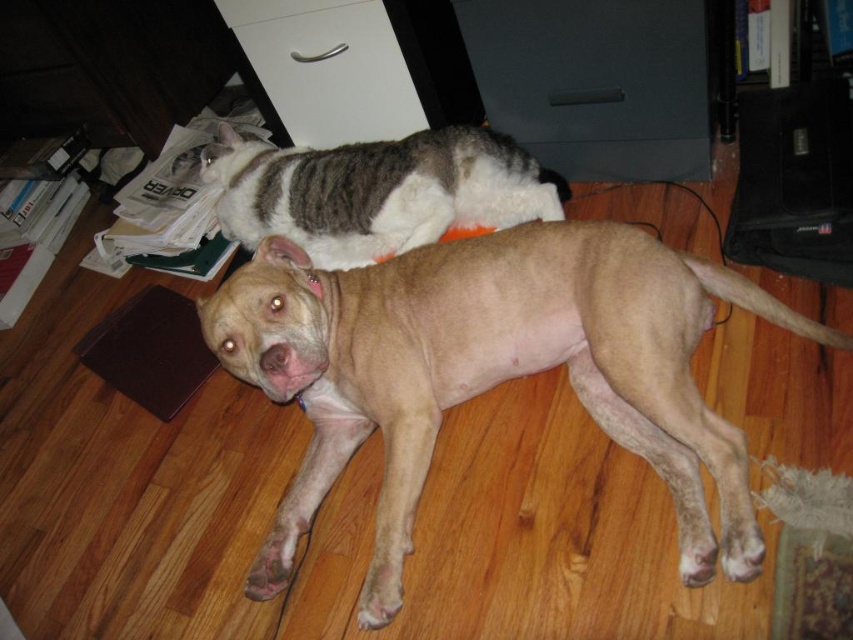
You are a photographer trying to capture a photo of both the light brown smooth dog at center and the striped fur cat at upper center. Since you want to include both animals in the frame, can you determine which animal is positioned to the right side of the other?

The light brown smooth dog at center is to the right of striped fur cat at upper center, so the dog is positioned to the right of the cat.

Consider the image. You are a delivery robot that is 0.5 meters wide. You need to move from the point marked at (254, 196) to the front door located behind the cat. Can you navigate through the space between the dog and the cat without hitting either of them?

The distance between the dog and the cat is 1.66 meters, which is wider than the robot width of 0.5 meters, so yes, the robot can navigate through the space between the dog and the cat without hitting either of them.

You are a pet owner who wants to place a new pet bed for the striped fur cat at upper center. The bed is the same size as the white matte drawer at upper center. Will the cat fit comfortably in the bed?

The striped fur cat at upper center is wider than the white matte drawer at upper center. Since the bed is the same size as the drawer, the cat will not fit comfortably in the bed.